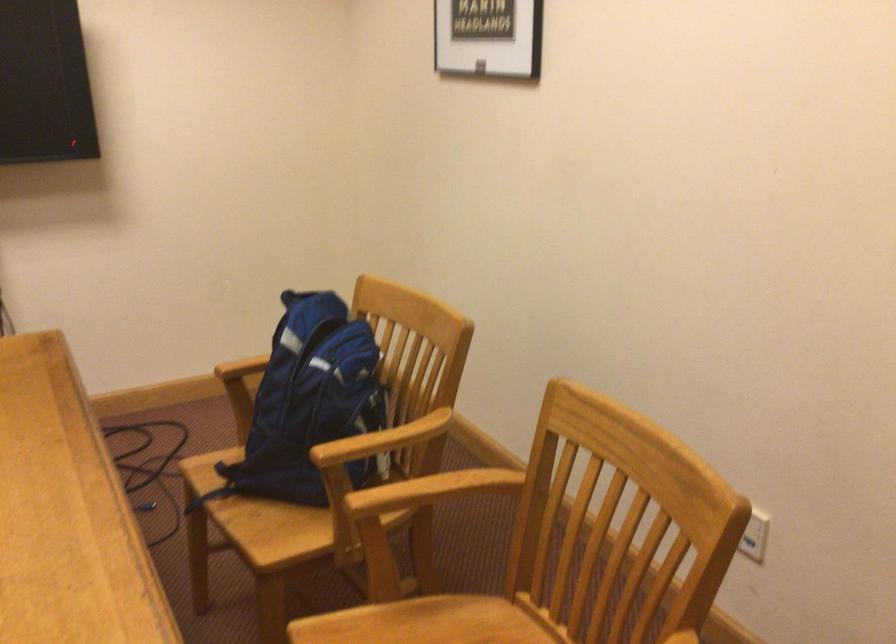
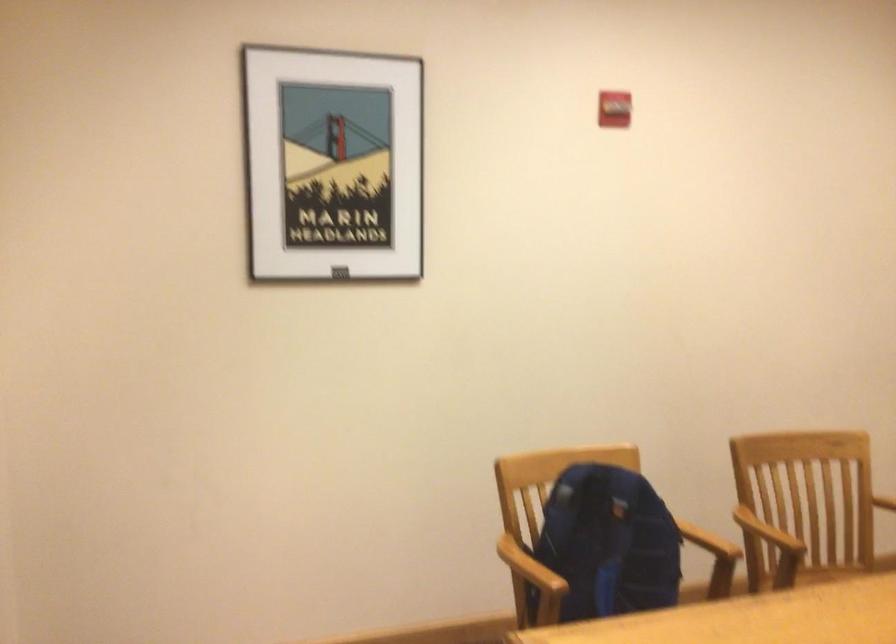
Locate, in the second image, the point that corresponds to point (416, 485) in the first image.

(767, 532)